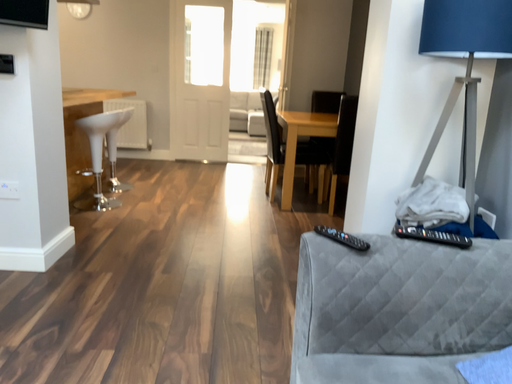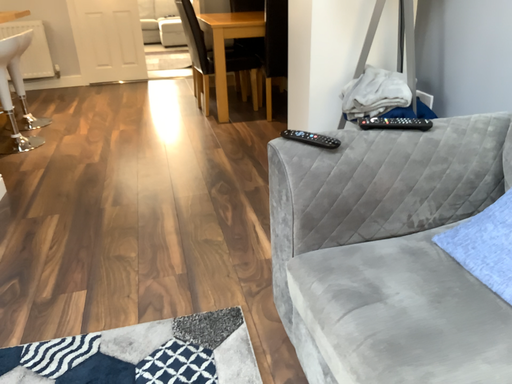
Question: Which way did the camera rotate in the video?

Choices:
 (A) rotated upward
 (B) rotated downward

Answer: (B)